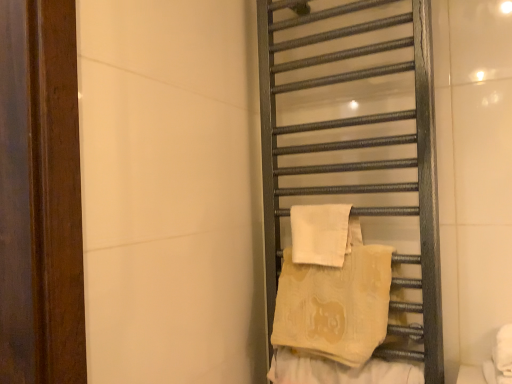
Question: In terms of width, does beige cotton beach towel at center-right, acting as the 2th beach towel starting from the top, look wider or thinner when compared to beige textured towel at center-right?

Choices:
 (A) thin
 (B) wide

Answer: (B)

Question: From a real-world perspective, is beige cotton beach towel at center-right, marked as the first beach towel in a bottom-to-top arrangement, above or below beige textured towel at center-right?

Choices:
 (A) above
 (B) below

Answer: (A)

Question: Which object is positioned farthest from the metallic towel rack at right?

Choices:
 (A) white cotton beach towel at right, the 1th beach towel viewed from the top
 (B) beige cotton beach towel at center-right, marked as the first beach towel in a bottom-to-top arrangement
 (C) beige textured towel at center-right

Answer: (C)

Question: Which object is the closest to the beige textured towel at center-right?

Choices:
 (A) beige cotton beach towel at center-right, marked as the first beach towel in a bottom-to-top arrangement
 (B) metallic towel rack at right
 (C) white cotton beach towel at right, the 1th beach towel viewed from the top

Answer: (A)